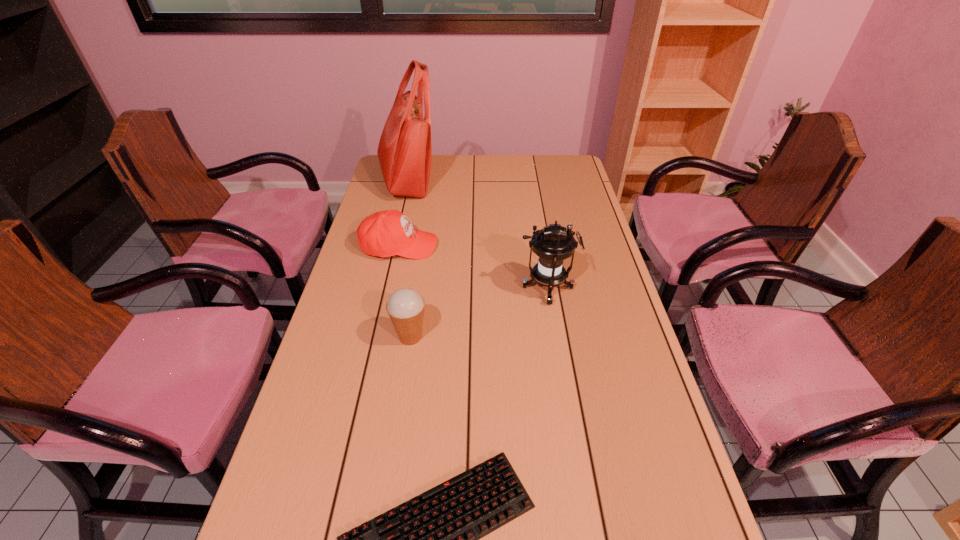
Where is `vacant space located on the right of the third shortest object`? The image size is (960, 540). vacant space located on the right of the third shortest object is located at coordinates (567, 337).

Image resolution: width=960 pixels, height=540 pixels. I want to click on vacant space located 0.050m on the front panel of the baseball cap, so click(x=452, y=246).

At what (x,y) coordinates should I click in order to perform the action: click on object present at the far edge. Please return your answer as a coordinate pair (x, y). Looking at the image, I should click on click(x=405, y=149).

Identify the location of handbag at the left edge. The image size is (960, 540). (405, 149).

Find the location of a particular element. This screenshot has width=960, height=540. baseball cap situated at the left edge is located at coordinates (386, 233).

Image resolution: width=960 pixels, height=540 pixels. What are the coordinates of `object that is at the right edge` in the screenshot? It's located at (553, 244).

Image resolution: width=960 pixels, height=540 pixels. In order to click on object that is at the far left corner in this screenshot , I will do `click(405, 149)`.

Identify the location of vacant space at the far edge of the desktop. (538, 176).

In the image, there is a desktop. Find the location of `free space at the left edge`. free space at the left edge is located at coordinates (308, 426).

What are the coordinates of `vacant space at the right edge` in the screenshot? It's located at (601, 233).